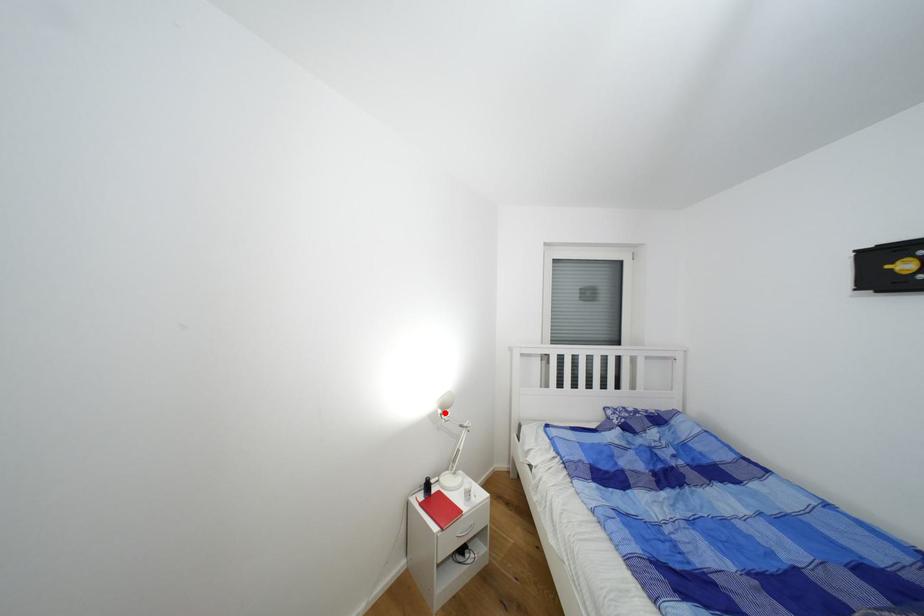
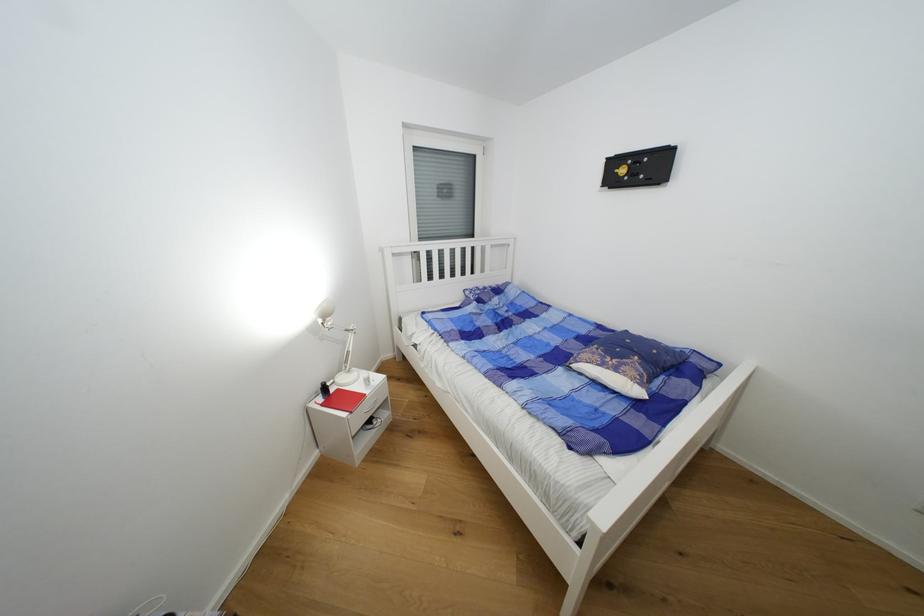
Find the pixel in the second image that matches the highlighted location in the first image.

(325, 323)